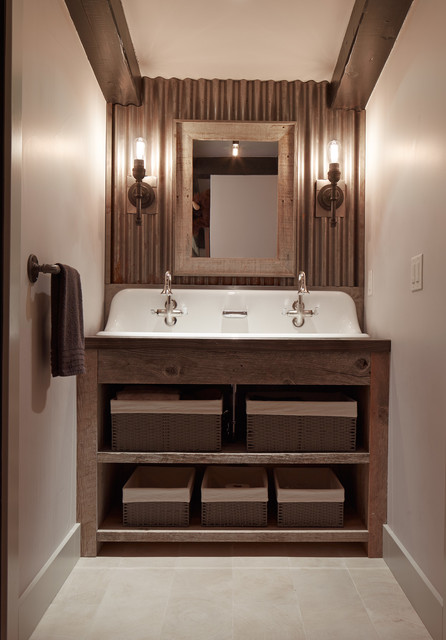
Image resolution: width=446 pixels, height=640 pixels. Identify the location of faucet. (168, 292), (300, 290).